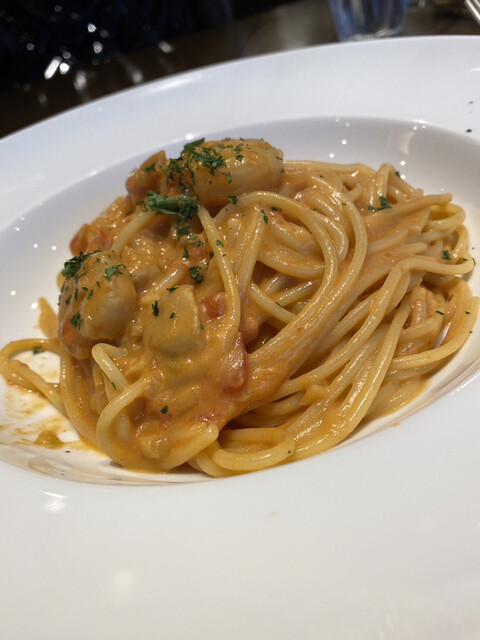
Where is `lights in the background`? lights in the background is located at coordinates (74, 50).